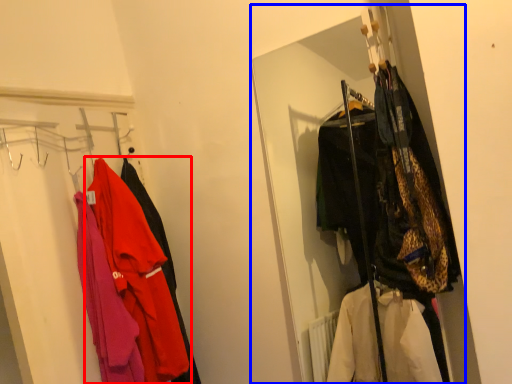
Question: Which of the following is the farthest to the observer, jacket (highlighted by a red box) or closet (highlighted by a blue box)?

Choices:
 (A) jacket
 (B) closet

Answer: (A)